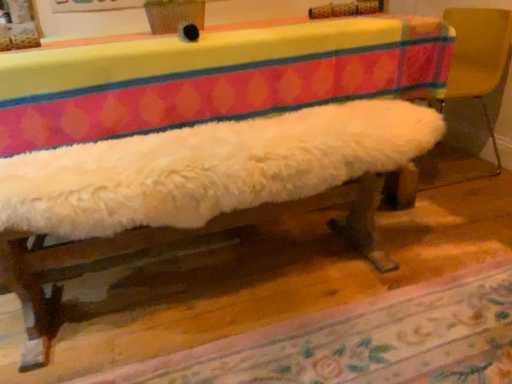
Question: From a real-world perspective, is white fluffy cushion at right above or below floral carpet at lower center?

Choices:
 (A) above
 (B) below

Answer: (A)

Question: Relative to floral carpet at lower center, is white fluffy cushion at right in front or behind?

Choices:
 (A) front
 (B) behind

Answer: (B)

Question: Is white fluffy cushion at right inside or outside of floral carpet at lower center?

Choices:
 (A) outside
 (B) inside

Answer: (A)

Question: Considering the positions of floral carpet at lower center and white fluffy cushion at right in the image, is floral carpet at lower center taller or shorter than white fluffy cushion at right?

Choices:
 (A) short
 (B) tall

Answer: (A)

Question: Is floral carpet at lower center wider or thinner than white fluffy cushion at right?

Choices:
 (A) wide
 (B) thin

Answer: (A)

Question: In the image, is floral carpet at lower center on the left side or the right side of white fluffy cushion at right?

Choices:
 (A) left
 (B) right

Answer: (A)

Question: Is floral carpet at lower center in front of or behind white fluffy cushion at right in the image?

Choices:
 (A) front
 (B) behind

Answer: (A)